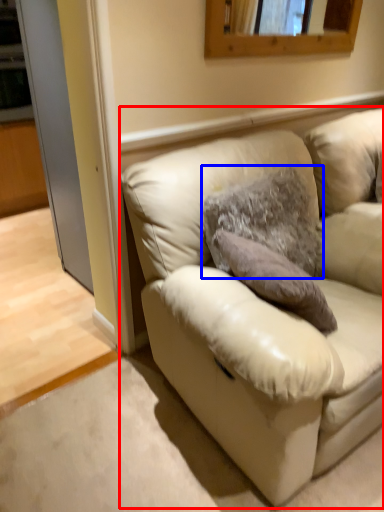
Question: Among these objects, which one is farthest to the camera, studio couch (highlighted by a red box) or pillow (highlighted by a blue box)?

Choices:
 (A) studio couch
 (B) pillow

Answer: (B)